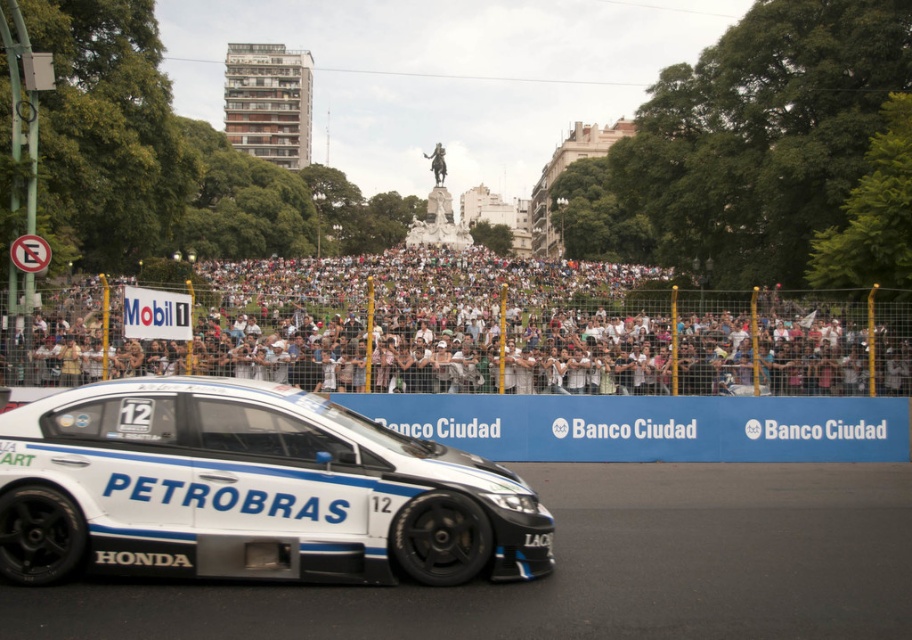
Is white crowd at upper center below white smooth asphalt at center?

No.

In the scene shown: Measure the distance between white crowd at upper center and camera.

The distance of white crowd at upper center from camera is 19.75 meters.

Describe the element at coordinates (468, 330) in the screenshot. Image resolution: width=912 pixels, height=640 pixels. I see `white crowd at upper center` at that location.

Where is `white crowd at upper center`? Image resolution: width=912 pixels, height=640 pixels. white crowd at upper center is located at coordinates (468, 330).

Is white smooth asphalt at center above white glossy car at center?

Actually, white smooth asphalt at center is below white glossy car at center.

Is point (814, 630) positioned in front of point (547, 529)?

That is True.

The height and width of the screenshot is (640, 912). I want to click on white smooth asphalt at center, so click(582, 568).

Who is lower down, white crowd at upper center or white glossy car at center?

white glossy car at center

Who is positioned more to the right, white crowd at upper center or white glossy car at center?

white glossy car at center

Is point (231, 355) positioned behind point (115, 529)?

Yes, it is behind point (115, 529).

Locate an element on the screen. This screenshot has height=640, width=912. white crowd at upper center is located at coordinates (468, 330).